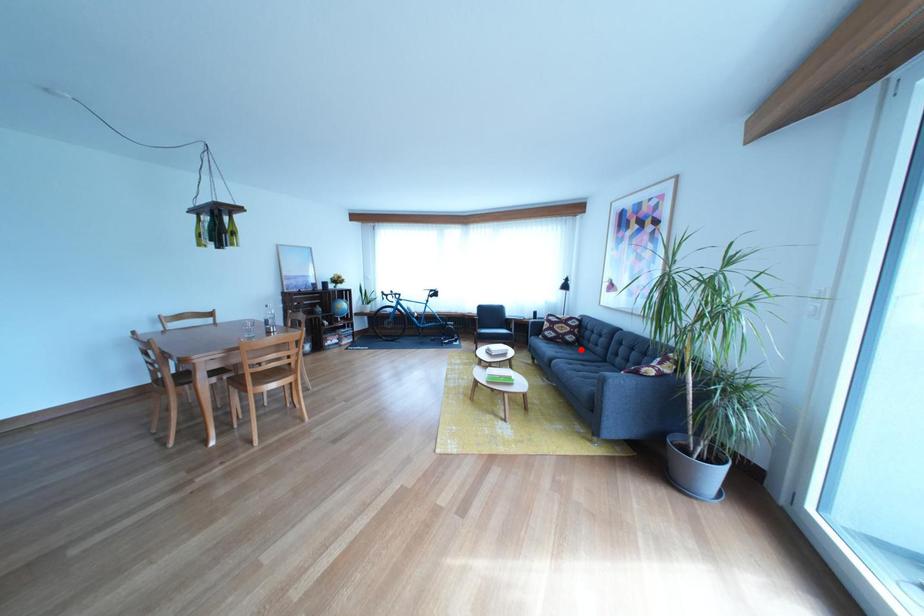
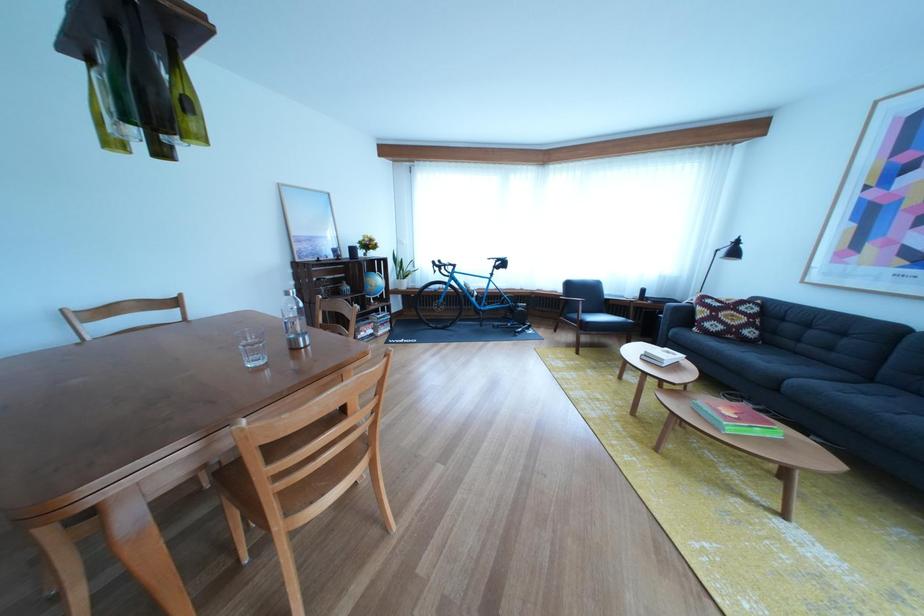
Question: I am providing you with two images of the same scene from different viewpoints. Given a red point in image1, look at the same physical point in image2. Is it:

Choices:
 (A) Closer to the viewpoint
 (B) Farther from the viewpoint

Answer: (A)